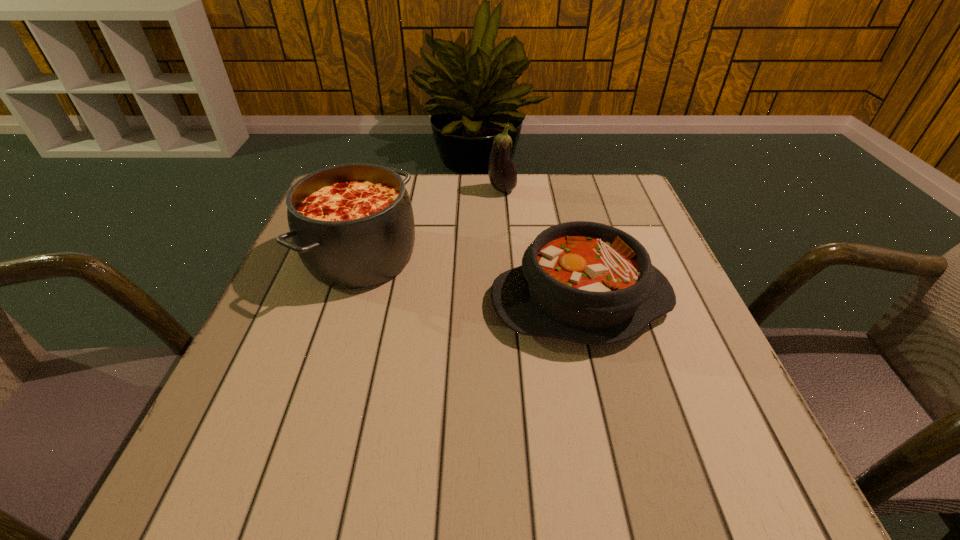
Locate an element on the screen. free space that satisfies the following two spatial constraints: 1. on the front side of the taller casserole; 2. on the right side of the right casserole is located at coordinates (348, 301).

The height and width of the screenshot is (540, 960). In order to click on free space that satisfies the following two spatial constraints: 1. on the front side of the shorter casserole; 2. on the left side of the taller casserole in this screenshot , I will do `click(348, 301)`.

Identify the location of vacant space that satisfies the following two spatial constraints: 1. on the front side of the taller casserole; 2. on the right side of the shorter casserole. The image size is (960, 540). (348, 301).

Identify the location of vacant space that satisfies the following two spatial constraints: 1. on the front side of the shorter casserole; 2. on the left side of the left casserole. (348, 301).

Find the location of a particular element. vacant space that satisfies the following two spatial constraints: 1. on the front side of the leftmost object; 2. on the left side of the shortest object is located at coordinates (348, 301).